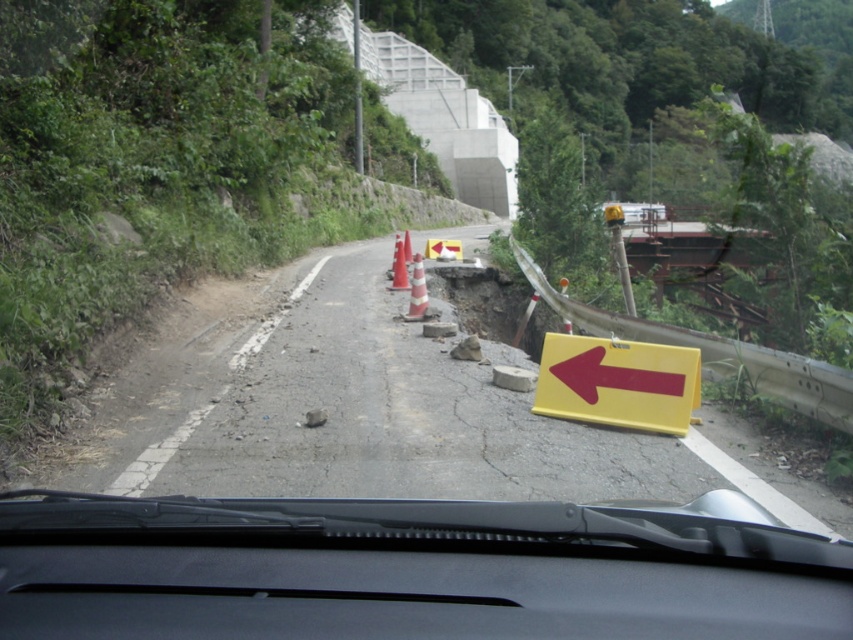
Question: Does yellow plastic sign at right have a greater width compared to white striped cone at center?

Choices:
 (A) no
 (B) yes

Answer: (B)

Question: Does yellow plastic sign at right appear on the right side of orange/smooth/cone at center?

Choices:
 (A) no
 (B) yes

Answer: (B)

Question: Which point is farther from the camera taking this photo?

Choices:
 (A) (579, 353)
 (B) (602, 362)
 (C) (611, 324)

Answer: (C)

Question: Which of the following is the closest to the observer?

Choices:
 (A) yellow plastic sign at right
 (B) orange/smooth/cone at center
 (C) white striped cone at center

Answer: (A)

Question: Can you confirm if yellow plastic sign at center is positioned above yellow plastic sign at right?

Choices:
 (A) no
 (B) yes

Answer: (A)

Question: Which point is closer to the camera?

Choices:
 (A) white striped cone at center
 (B) yellow plastic sign at center

Answer: (B)